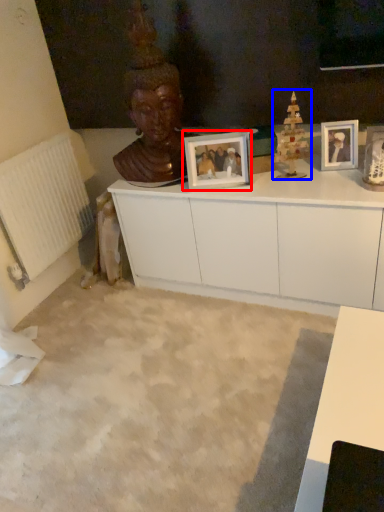
Question: Which point is closer to the camera, picture frame (highlighted by a red box) or toy (highlighted by a blue box)?

Choices:
 (A) picture frame
 (B) toy

Answer: (B)